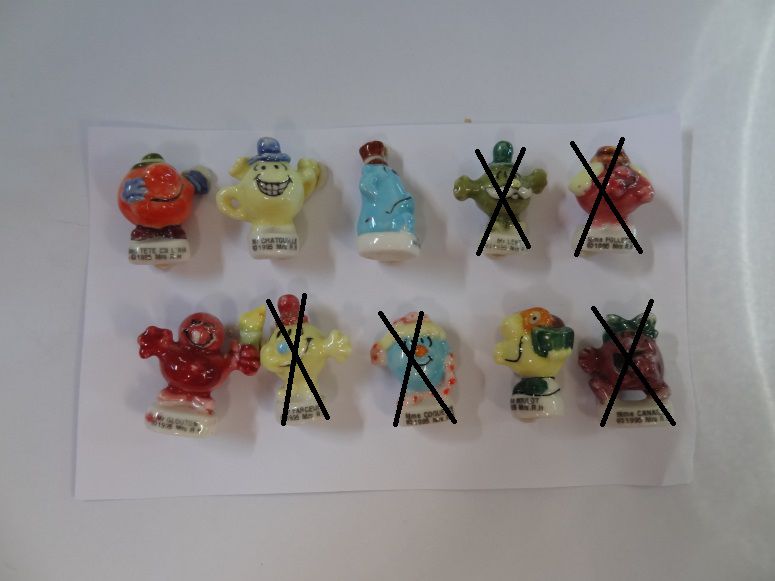
I want to click on figurines, so click(208, 356), click(305, 357), click(403, 364), click(529, 362), click(612, 362), click(604, 193), click(494, 193), click(384, 198), click(273, 198), click(157, 198).